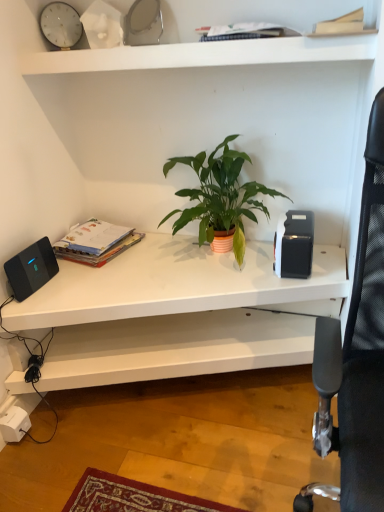
Question: Considering the positions of light brown paper at upper right, which ranks as the second paperback book in back-to-front order, and green matte plant at center in the image, is light brown paper at upper right, which ranks as the second paperback book in back-to-front order, wider or thinner than green matte plant at center?

Choices:
 (A) wide
 (B) thin

Answer: (B)

Question: Considering the positions of point (322, 26) and point (173, 223), is point (322, 26) closer or farther from the camera than point (173, 223)?

Choices:
 (A) closer
 (B) farther

Answer: (A)

Question: Considering the real-world distances, which object is farthest from the matte paperbacks at left, acting as the 2th paperback book starting from the top?

Choices:
 (A) black matte speaker at left
 (B) light brown paper at upper right, the first paperback book from the top
 (C) green matte plant at center
 (D) black mesh computer chair at right
 (E) white matte shelf at upper center, positioned as the first shelf in top-to-bottom order

Answer: (B)

Question: Estimate the real-world distances between objects in this image. Which object is closer to the white glossy clock at upper left?

Choices:
 (A) black matte speaker at left
 (B) white matte desk at center, which ranks as the second shelf in top-to-bottom order
 (C) light brown paper at upper right, which ranks as the second paperback book in back-to-front order
 (D) matte paperbacks at left, the second paperback book in the right-to-left sequence
 (E) white matte shelf at upper center, positioned as the first shelf in top-to-bottom order

Answer: (E)